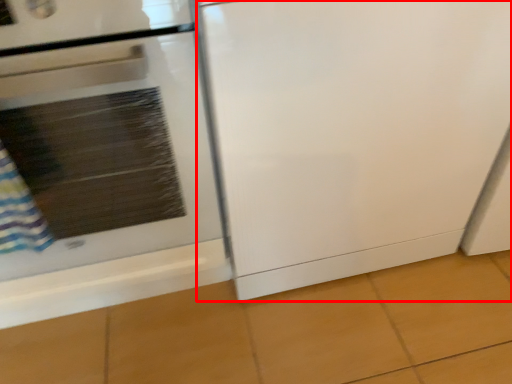
Question: Where is screen door (annotated by the red box) located in relation to home appliance in the image?

Choices:
 (A) right
 (B) left

Answer: (A)